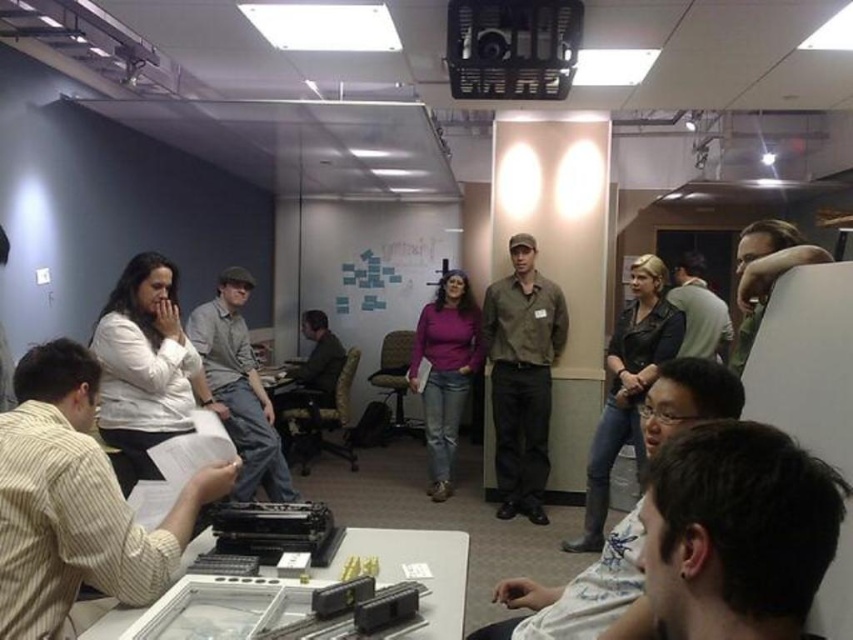
You are part of the group at the table. You need to pass a document to the person wearing the dark gray sweater at upper right, who is sitting behind the purple matte shirt at center. Can you reach them directly without moving around the table?

The purple matte shirt at center is closer to you than the dark gray sweater at upper right, so you cannot reach them directly without moving around the table because the purple matte shirt at center is in the way.

You are a photographer trying to capture a candid shot of the dark brown hair at lower right and the purple matte shirt at center. Since you want to focus on the subject, which one should you adjust your camera to prioritize focusing on first if you want to ensure both are in frame?

The dark brown hair at lower right is shorter than the purple matte shirt at center, so you should prioritize focusing on the purple matte shirt at center first to ensure both are in frame.

You are a photographer standing at the back of the room and want to take a photo of the dark brown hair at lower right and the purple matte shirt at center. Which object will appear larger in the photo?

The dark brown hair at lower right will appear larger in the photo because it is closer to the viewer than the purple matte shirt at center.